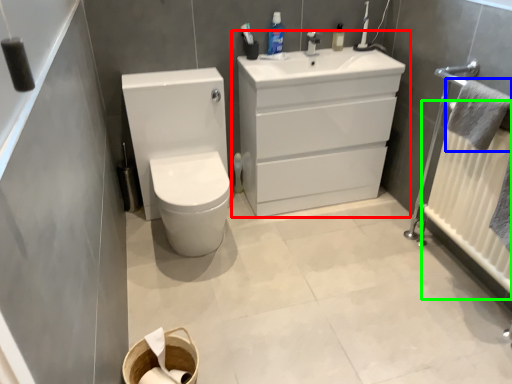
Question: Considering the real-world distances, which object is farthest from bathroom cabinet (highlighted by a red box)? bath towel (highlighted by a blue box) or radiator (highlighted by a green box)?

Choices:
 (A) bath towel
 (B) radiator

Answer: (A)